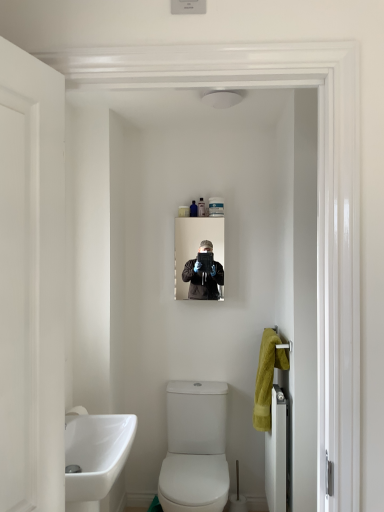
Question: Is white glossy towel rack at right, placed as the 2th door when sorted from top to bottom, to the left of white matte door at left, which is the second door in right-to-left order, from the viewer's perspective?

Choices:
 (A) yes
 (B) no

Answer: (B)

Question: Can you confirm if white glossy towel rack at right, the second door when ordered from front to back, is thinner than white matte door at left, the 1th door viewed from the left?

Choices:
 (A) no
 (B) yes

Answer: (A)

Question: From a real-world perspective, is white glossy towel rack at right, which appears as the first door when viewed from the right, over white matte door at left, the 1th door viewed from the front?

Choices:
 (A) yes
 (B) no

Answer: (B)

Question: Considering the relative sizes of white glossy towel rack at right, which appears as the first door when viewed from the right, and white matte door at left, marked as the first door in a top-to-bottom arrangement, in the image provided, is white glossy towel rack at right, which appears as the first door when viewed from the right, bigger than white matte door at left, marked as the first door in a top-to-bottom arrangement,?

Choices:
 (A) yes
 (B) no

Answer: (A)

Question: Is white glossy towel rack at right, which appears as the first door when viewed from the right, wider than white matte door at left, the 1th door viewed from the front?

Choices:
 (A) yes
 (B) no

Answer: (A)

Question: From the image's perspective, is matte black mirror at center positioned above or below translucent plastic container at upper center, the third toiletry when ordered from left to right?

Choices:
 (A) above
 (B) below

Answer: (B)

Question: Considering the positions of point (177, 222) and point (203, 206), is point (177, 222) closer or farther from the camera than point (203, 206)?

Choices:
 (A) farther
 (B) closer

Answer: (A)

Question: In the image, is matte black mirror at center positioned in front of or behind translucent plastic container at upper center, placed as the second toiletry when sorted from right to left?

Choices:
 (A) behind
 (B) front

Answer: (B)

Question: From a real-world perspective, is matte black mirror at center positioned above or below translucent plastic container at upper center, placed as the second toiletry when sorted from right to left?

Choices:
 (A) above
 (B) below

Answer: (B)

Question: From the image's perspective, is translucent plastic container at upper center, placed as the second toiletry when sorted from right to left, above or below white plastic container at upper center, the fourth toiletry from the right?

Choices:
 (A) below
 (B) above

Answer: (B)

Question: In the image, is translucent plastic container at upper center, the third toiletry when ordered from left to right, positioned in front of or behind white plastic container at upper center, the fourth toiletry from the right?

Choices:
 (A) behind
 (B) front

Answer: (A)

Question: In terms of height, does translucent plastic container at upper center, the third toiletry when ordered from left to right, look taller or shorter compared to white plastic container at upper center, the 1th toiletry from the left?

Choices:
 (A) short
 (B) tall

Answer: (B)

Question: From a real-world perspective, relative to white plastic container at upper center, the fourth toiletry from the right, is translucent plastic container at upper center, the third toiletry when ordered from left to right, vertically above or below?

Choices:
 (A) above
 (B) below

Answer: (A)

Question: Is white plastic container at upper center, the fourth toiletry from the right, in front of or behind white matte door at left, positioned as the 2th door in back-to-front order, in the image?

Choices:
 (A) behind
 (B) front

Answer: (A)

Question: Is white plastic container at upper center, the 1th toiletry from the left, bigger or smaller than white matte door at left, positioned as the 2th door in bottom-to-top order?

Choices:
 (A) small
 (B) big

Answer: (A)